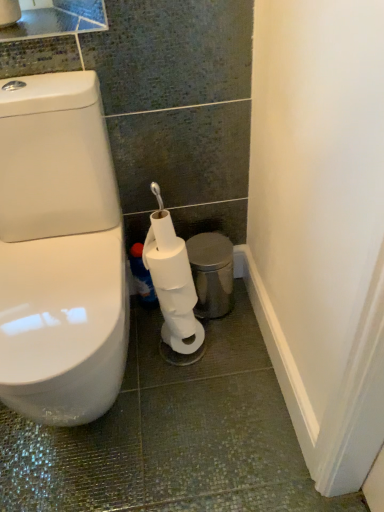
Question: Can you see blue glossy bottle at lower center touching metallic silver trash can at lower right?

Choices:
 (A) no
 (B) yes

Answer: (A)

Question: Can you confirm if blue glossy bottle at lower center is positioned to the left of metallic silver trash can at lower right?

Choices:
 (A) no
 (B) yes

Answer: (B)

Question: Is blue glossy bottle at lower center to the right of metallic silver trash can at lower right from the viewer's perspective?

Choices:
 (A) yes
 (B) no

Answer: (B)

Question: Considering the relative sizes of blue glossy bottle at lower center and metallic silver trash can at lower right in the image provided, is blue glossy bottle at lower center smaller than metallic silver trash can at lower right?

Choices:
 (A) yes
 (B) no

Answer: (A)

Question: From a real-world perspective, is blue glossy bottle at lower center below metallic silver trash can at lower right?

Choices:
 (A) yes
 (B) no

Answer: (B)

Question: In terms of width, does blue glossy bottle at lower center look wider or thinner when compared to metallic silver trash can at lower right?

Choices:
 (A) thin
 (B) wide

Answer: (A)

Question: Is blue glossy bottle at lower center taller or shorter than metallic silver trash can at lower right?

Choices:
 (A) tall
 (B) short

Answer: (B)

Question: From a real-world perspective, relative to metallic silver trash can at lower right, is blue glossy bottle at lower center vertically above or below?

Choices:
 (A) below
 (B) above

Answer: (B)

Question: In the image, is blue glossy bottle at lower center positioned in front of or behind metallic silver trash can at lower right?

Choices:
 (A) behind
 (B) front

Answer: (A)

Question: Is metallic silver trash can at lower right to the left or to the right of blue glossy bottle at lower center in the image?

Choices:
 (A) right
 (B) left

Answer: (A)

Question: In terms of size, does metallic silver trash can at lower right appear bigger or smaller than blue glossy bottle at lower center?

Choices:
 (A) small
 (B) big

Answer: (B)

Question: Looking at their shapes, would you say metallic silver trash can at lower right is wider or thinner than blue glossy bottle at lower center?

Choices:
 (A) wide
 (B) thin

Answer: (A)

Question: In the image, is metallic silver trash can at lower right positioned in front of or behind blue glossy bottle at lower center?

Choices:
 (A) behind
 (B) front

Answer: (B)

Question: In the image, is white matte toilet paper at lower center on the left side or the right side of metallic silver trash can at lower right?

Choices:
 (A) right
 (B) left

Answer: (B)

Question: Relative to metallic silver trash can at lower right, is white matte toilet paper at lower center in front or behind?

Choices:
 (A) behind
 (B) front

Answer: (B)